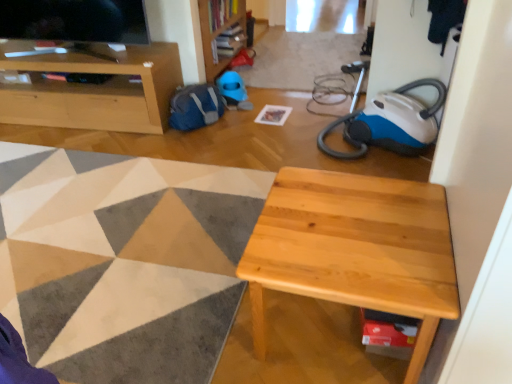
The image size is (512, 384). In order to click on vacant area on top of natural wood table at center (from a real-world perspective) in this screenshot , I will do `click(355, 223)`.